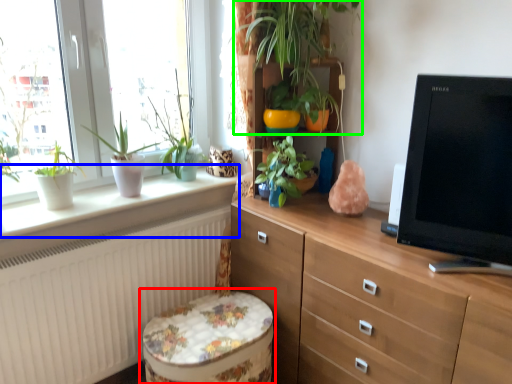
Question: Which is farther away from music stool (highlighted by a red box)? window sill (highlighted by a blue box) or houseplant (highlighted by a green box)?

Choices:
 (A) window sill
 (B) houseplant

Answer: (B)